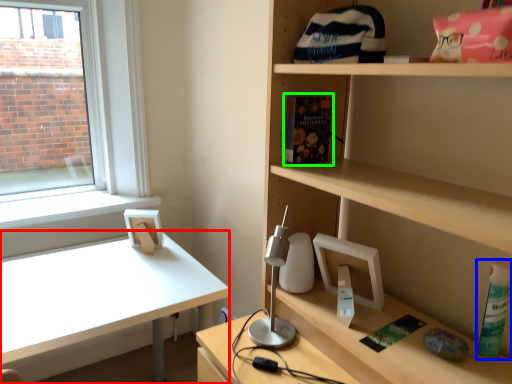
Question: Estimate the real-world distances between objects in this image. Which object is farther from desk (highlighted by a red box), bottle (highlighted by a blue box) or book (highlighted by a green box)?

Choices:
 (A) bottle
 (B) book

Answer: (A)